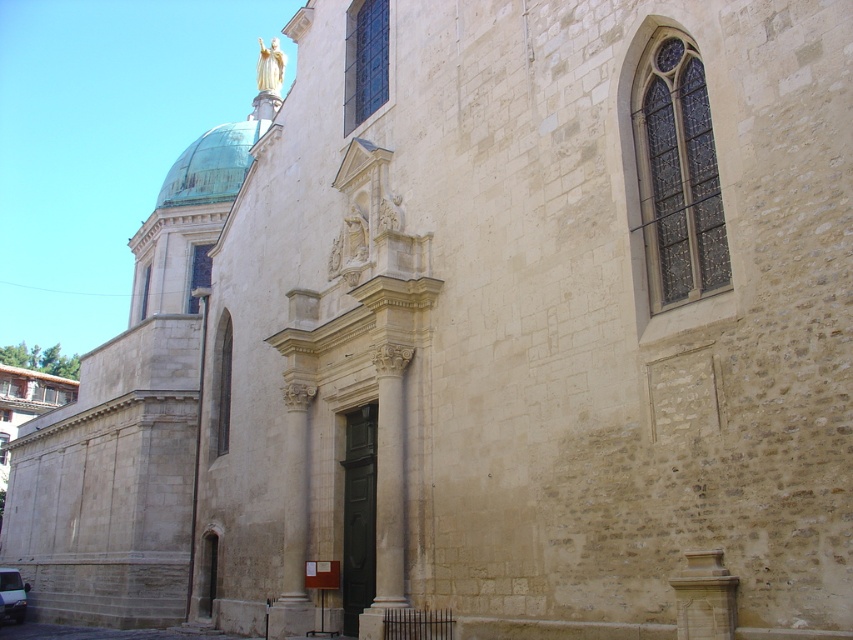
Between green copper dome at upper left and white glossy van at lower left, which one appears on the left side from the viewer's perspective?

From the viewer's perspective, green copper dome at upper left appears more on the left side.

Is green copper dome at upper left bigger than white glossy van at lower left?

Indeed, green copper dome at upper left has a larger size compared to white glossy van at lower left.

Between point (194, 163) and point (16, 605), which one is positioned in front?

Positioned in front is point (16, 605).

Find the location of a particular element. green copper dome at upper left is located at coordinates (212, 164).